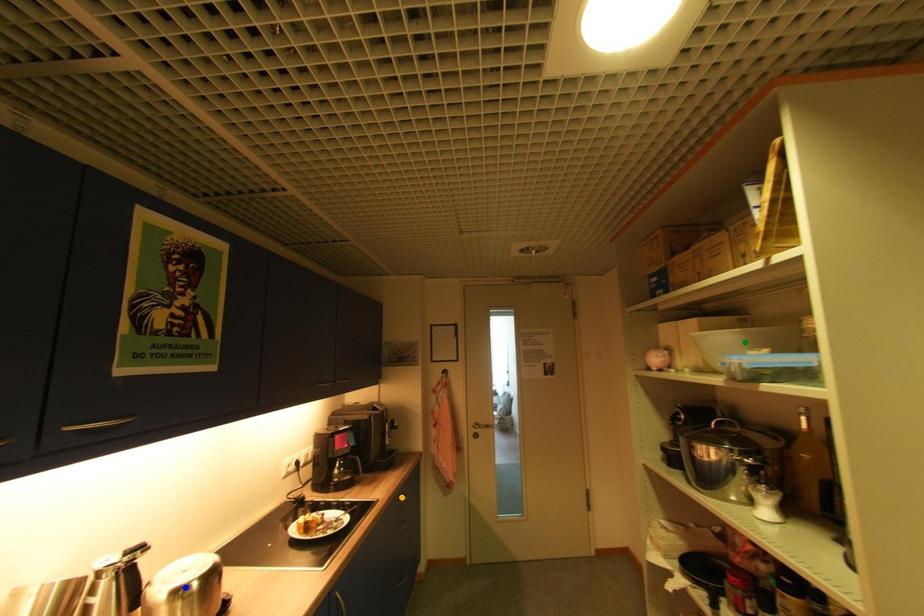
Order these from nearest to farthest:
orange point | green point | blue point

blue point → green point → orange point